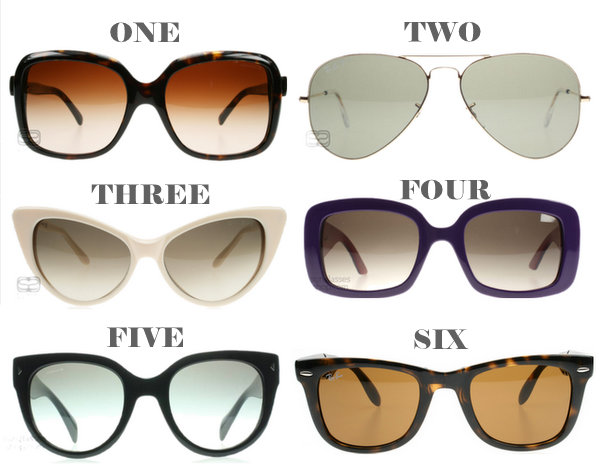
At what (x,y) coordinates should I click in order to perform the action: click on black frames. Please return your answer as a coordinate pair (x, y). This screenshot has height=468, width=600. Looking at the image, I should click on (21, 370).